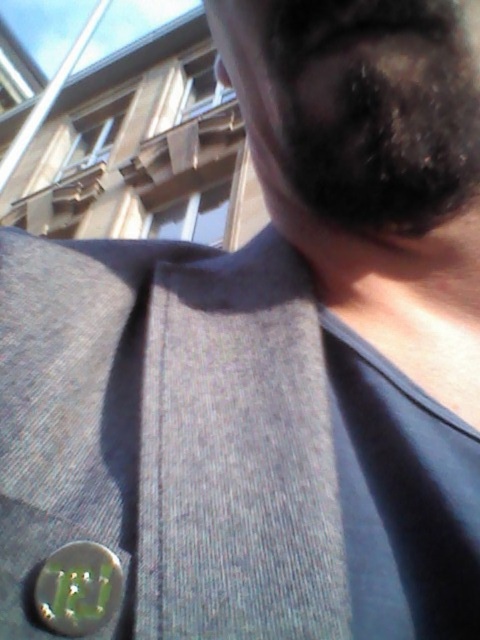
You are a photographer adjusting your camera settings to capture the best shot of the black fuzzy beard at upper right and the green metallic button at lower left. Which object is positioned more to the right side of the frame?

The black fuzzy beard at upper right is positioned more to the right side of the frame than the green metallic button at lower left.

Based on the photo, you are a fashion designer analyzing this image. You need to decide which object, the black fuzzy beard at upper right or the green metallic button at lower left, has a greater horizontal span. Based on the scene, which one is wider?

The black fuzzy beard at upper right is wider than the green metallic button at lower left because its width surpasses the button.

You are a photographer adjusting your camera settings to capture the metallic button with a green emblem on the dark gray suit jacket. You notice a point in the image at coordinates point (380, 129). What object is located at this point?

The object located at point (380, 129) is the black fuzzy beard at upper right.